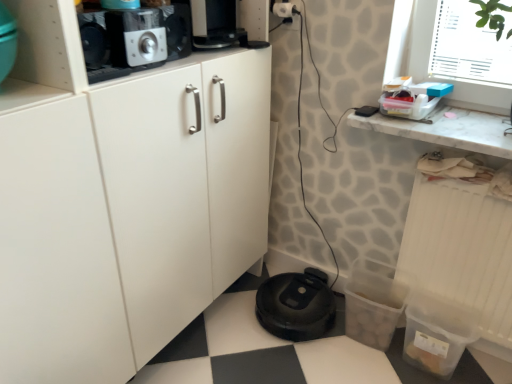
The image size is (512, 384). In order to click on free location in front of black plastic robot vacuum cleaner at lower center in this screenshot , I will do `click(300, 359)`.